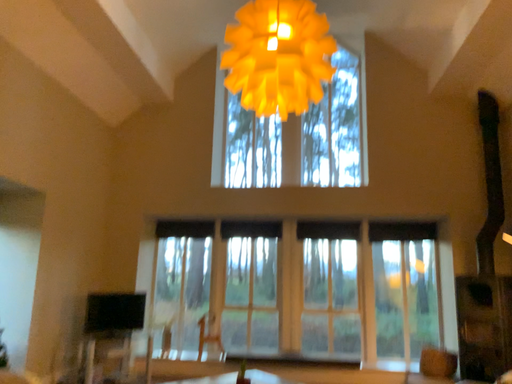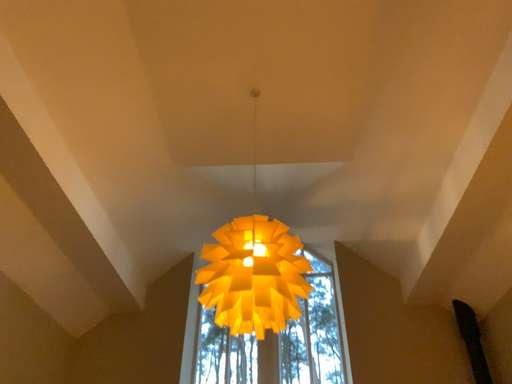
Question: How did the camera likely rotate when shooting the video?

Choices:
 (A) rotated downward
 (B) rotated upward

Answer: (B)